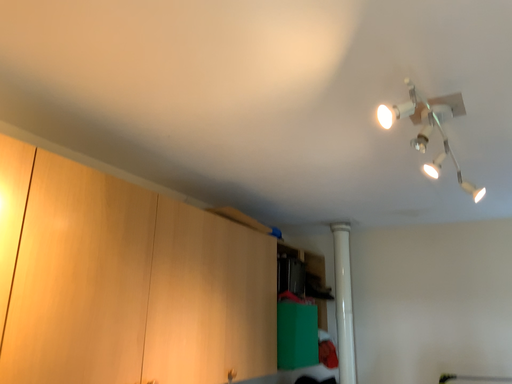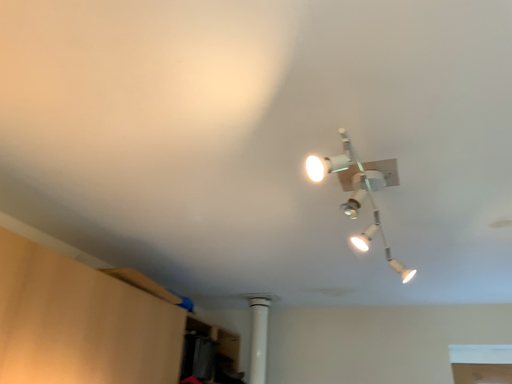
Question: Which way did the camera rotate in the video?

Choices:
 (A) rotated right
 (B) rotated left

Answer: (A)